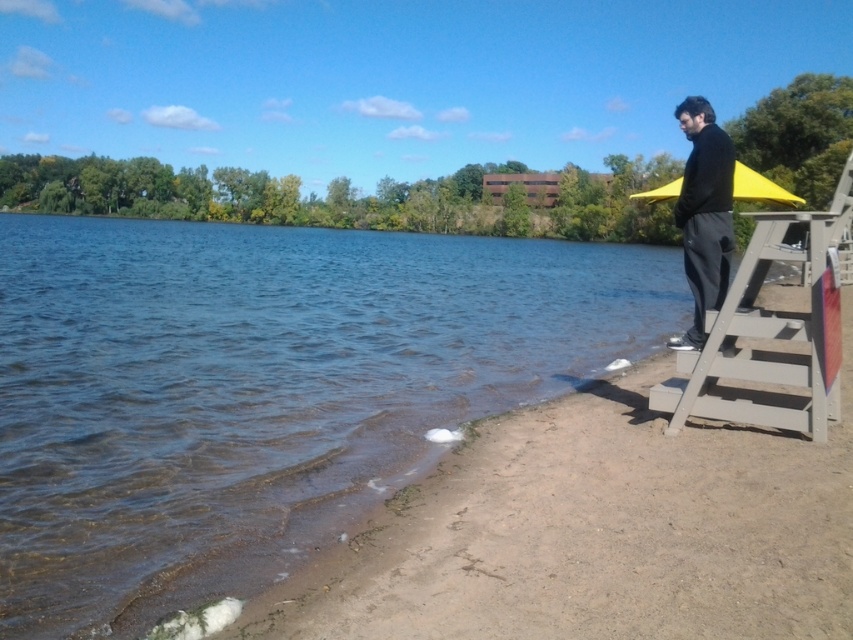
You are standing at the point marked by the coordinates point (704,214) in the image. What object are you currently standing on?

You are standing on the black matte jacket at upper right.